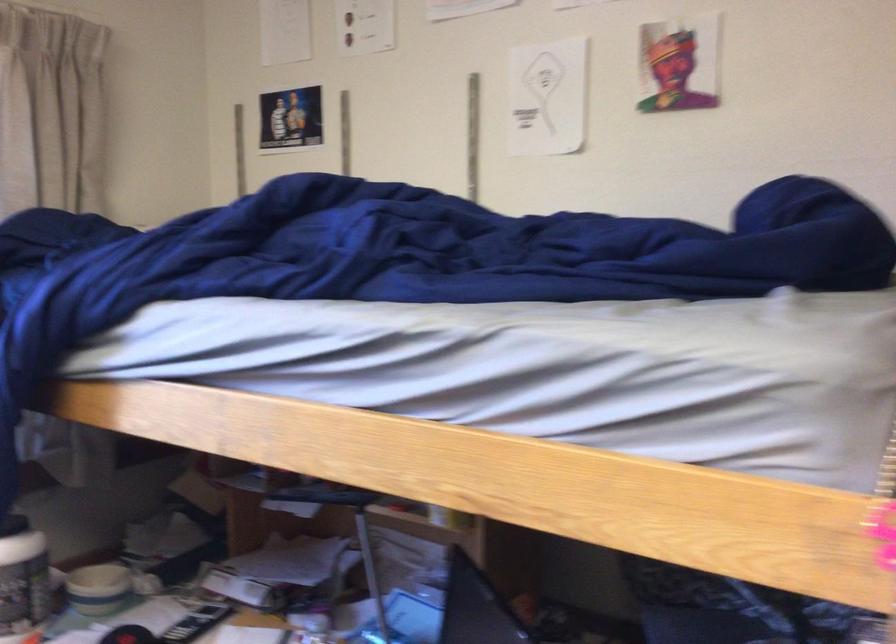
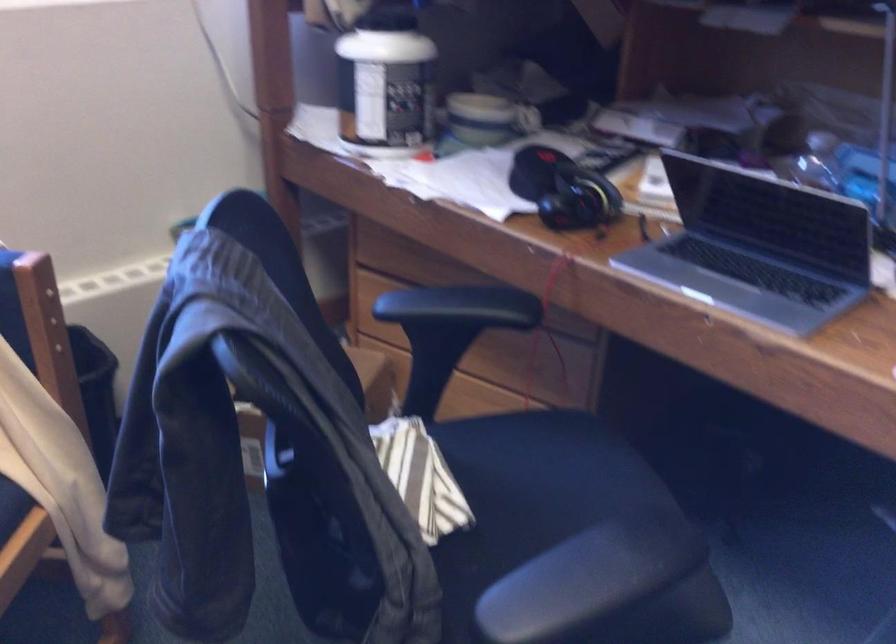
Question: How did the camera likely rotate?

Choices:
 (A) Left
 (B) Right
 (C) Up
 (D) Down

Answer: (D)